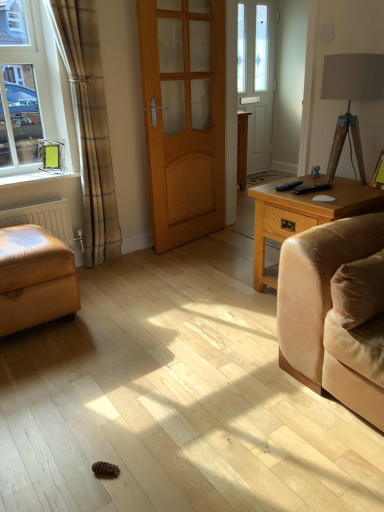
Locate an element on the screen. free point in front of plaid fabric curtain at left is located at coordinates (113, 273).